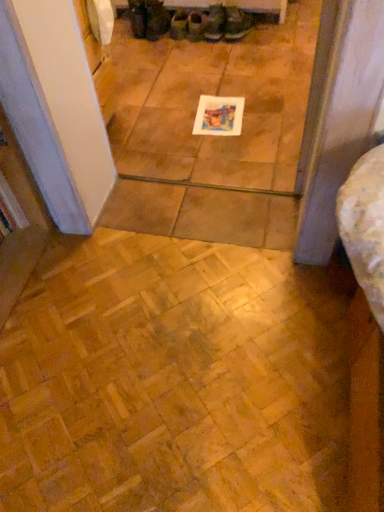
Question: From the image's perspective, is leather boot at center, the 5th footwear when ordered from left to right, located above matte green fabric shoe at center, which ranks as the 3th footwear in right-to-left order?

Choices:
 (A) yes
 (B) no

Answer: (B)

Question: Does leather boot at center, the second footwear viewed from the right, have a larger size compared to matte green fabric shoe at center, which ranks as the 3th footwear in right-to-left order?

Choices:
 (A) yes
 (B) no

Answer: (A)

Question: From the image's perspective, does leather boot at center, the 5th footwear when ordered from left to right, appear lower than matte green fabric shoe at center, marked as the fourth footwear in a left-to-right arrangement?

Choices:
 (A) yes
 (B) no

Answer: (A)

Question: Is leather boot at center, the 5th footwear when ordered from left to right, thinner than matte green fabric shoe at center, marked as the fourth footwear in a left-to-right arrangement?

Choices:
 (A) yes
 (B) no

Answer: (A)

Question: Would you say matte green fabric shoe at center, marked as the fourth footwear in a left-to-right arrangement, is part of leather boot at center, the 5th footwear when ordered from left to right,'s contents?

Choices:
 (A) yes
 (B) no

Answer: (B)

Question: Considering the positions of point (223, 10) and point (190, 307), is point (223, 10) closer or farther from the camera than point (190, 307)?

Choices:
 (A) farther
 (B) closer

Answer: (A)

Question: Which is correct: leather boot at center, the second footwear viewed from the right, is inside wooden parquet floor at lower left, or outside of it?

Choices:
 (A) outside
 (B) inside

Answer: (A)

Question: From a real-world perspective, is leather boot at center, the 5th footwear when ordered from left to right, above or below wooden parquet floor at lower left?

Choices:
 (A) above
 (B) below

Answer: (A)

Question: Is leather boot at center, the 5th footwear when ordered from left to right, taller or shorter than wooden parquet floor at lower left?

Choices:
 (A) tall
 (B) short

Answer: (A)

Question: From a real-world perspective, is green canvas shoes at upper center, positioned as the 3th footwear in left-to-right order, physically located above or below white paper at center?

Choices:
 (A) above
 (B) below

Answer: (A)

Question: Visually, is green canvas shoes at upper center, positioned as the 3th footwear in left-to-right order, positioned to the left or to the right of white paper at center?

Choices:
 (A) left
 (B) right

Answer: (A)

Question: Which is correct: green canvas shoes at upper center, arranged as the 4th footwear when viewed from the right, is inside white paper at center, or outside of it?

Choices:
 (A) inside
 (B) outside

Answer: (B)

Question: Is green canvas shoes at upper center, positioned as the 3th footwear in left-to-right order, wider or thinner than white paper at center?

Choices:
 (A) wide
 (B) thin

Answer: (B)

Question: From a real-world perspective, is dark brown leather boot at upper center, the 2th footwear in the left-to-right sequence, physically located above or below green canvas shoes at upper center, arranged as the 4th footwear when viewed from the right?

Choices:
 (A) below
 (B) above

Answer: (B)

Question: Is point (167, 11) closer or farther from the camera than point (173, 25)?

Choices:
 (A) closer
 (B) farther

Answer: (B)